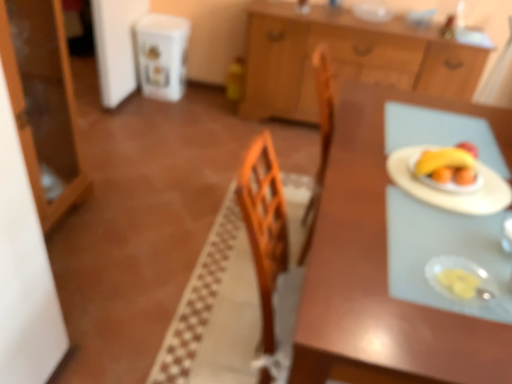
The width and height of the screenshot is (512, 384). Find the location of `vacant area that is in front of translucent plastic plate at right, which is the 2th tableware in top-to-bottom order`. vacant area that is in front of translucent plastic plate at right, which is the 2th tableware in top-to-bottom order is located at coordinates (458, 334).